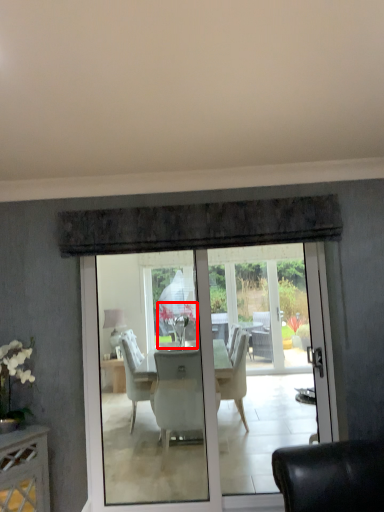
Question: From the image's perspective, what is the correct spatial positioning of flower (annotated by the red box) in reference to lamp?

Choices:
 (A) below
 (B) above

Answer: (B)